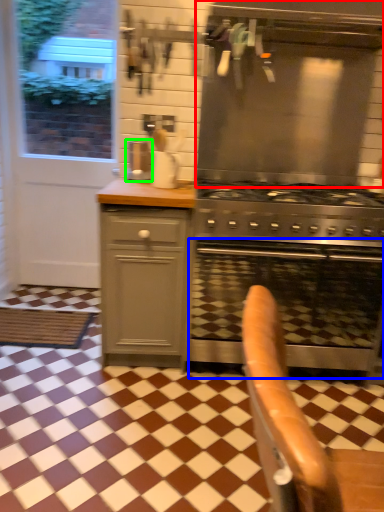
Question: Estimate the real-world distances between objects in this image. Which object is farther from vent (highlighted by a red box), oven (highlighted by a blue box) or coffee machine (highlighted by a green box)?

Choices:
 (A) oven
 (B) coffee machine

Answer: (A)